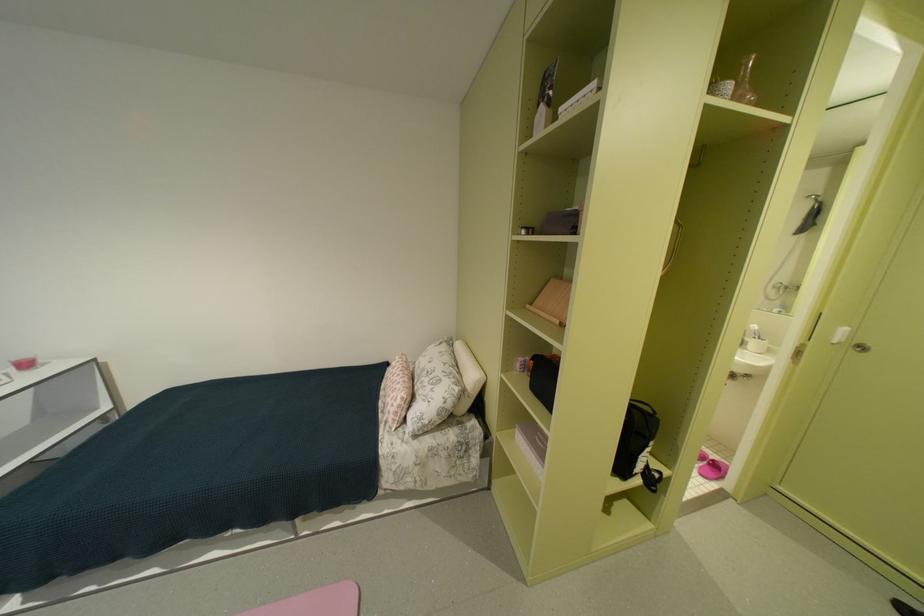
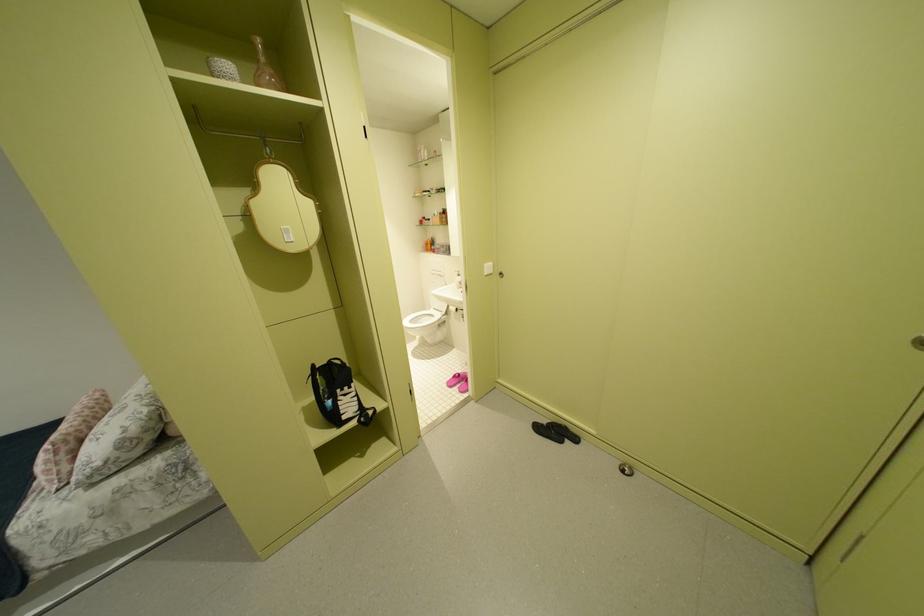
Question: What movement of the cameraman would produce the second image?

Choices:
 (A) Left
 (B) Right
 (C) Forward
 (D) Backward

Answer: (B)